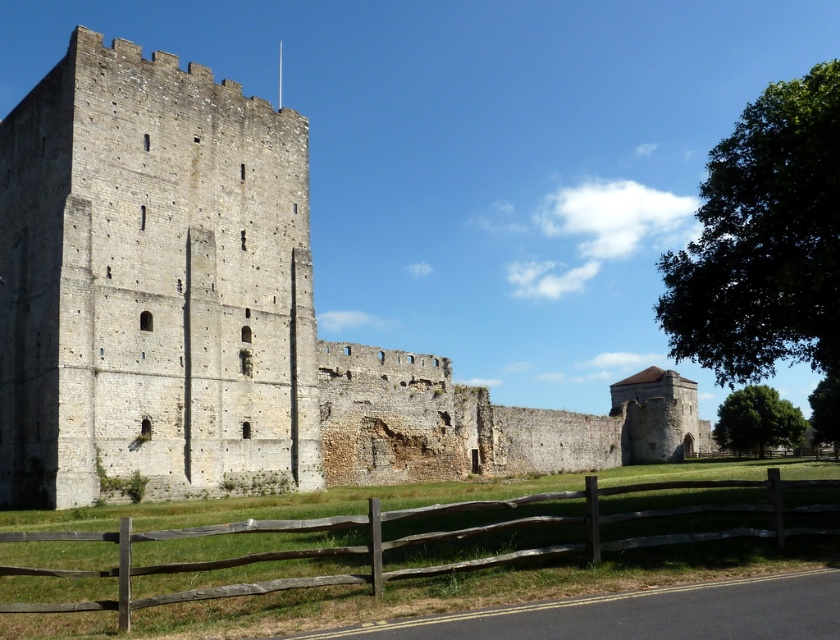
Is the position of stone wall at left more distant than that of brown wooden fence at lower center?

Yes, stone wall at left is further from the viewer.

Is point (292, 202) farther from camera compared to point (210, 570)?

Yes, point (292, 202) is farther from viewer.

This screenshot has width=840, height=640. I want to click on stone wall at left, so click(223, 314).